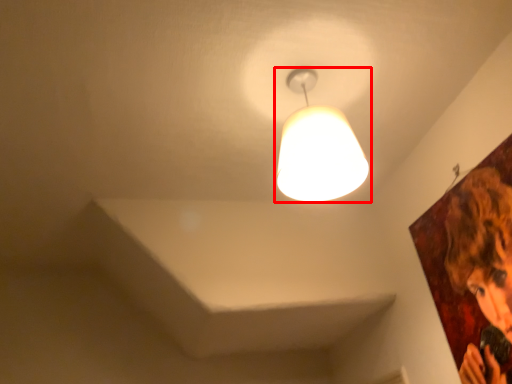
Question: From the image's perspective, where is lamp (annotated by the red box) located in relation to person in the image?

Choices:
 (A) below
 (B) above

Answer: (B)